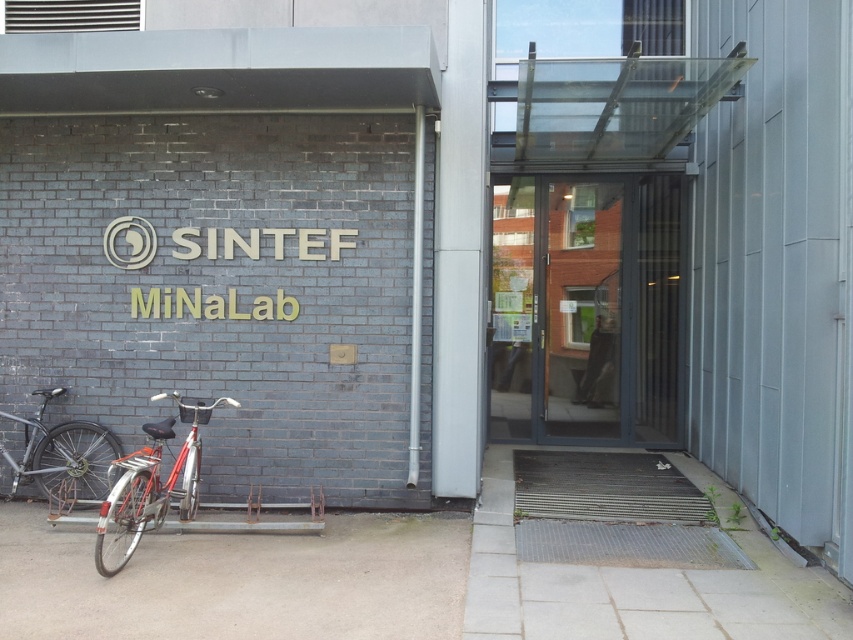
Who is positioned more to the right, transparent glass door at center or shiny red bicycle at lower left?

From the viewer's perspective, transparent glass door at center appears more on the right side.

Can you confirm if transparent glass door at center is wider than shiny red bicycle at lower left?

Indeed, transparent glass door at center has a greater width compared to shiny red bicycle at lower left.

From the picture: Who is more forward, [502,381] or [155,490]?

Point [155,490]

Where is `transparent glass door at center`? transparent glass door at center is located at coordinates (585, 308).

Which of these two, shiny red bicycle at lower left or silver metallic bicycle at lower left, stands taller?

Standing taller between the two is shiny red bicycle at lower left.

Does shiny red bicycle at lower left appear under silver metallic bicycle at lower left?

Yes.

What do you see at coordinates (149, 486) in the screenshot? The width and height of the screenshot is (853, 640). I see `shiny red bicycle at lower left` at bounding box center [149, 486].

The image size is (853, 640). What are the coordinates of `shiny red bicycle at lower left` in the screenshot? It's located at (149, 486).

Is transparent glass door at center below silver metallic bicycle at lower left?

No, transparent glass door at center is not below silver metallic bicycle at lower left.

Who is higher up, transparent glass door at center or silver metallic bicycle at lower left?

Positioned higher is transparent glass door at center.

This screenshot has width=853, height=640. What do you see at coordinates (585, 308) in the screenshot?
I see `transparent glass door at center` at bounding box center [585, 308].

You are a GUI agent. You are given a task and a screenshot of the screen. Output one action in this format:
    pyautogui.click(x=<x>, y=<y>)
    Task: Click on the transparent glass door at center
    
    Given the screenshot: What is the action you would take?
    pyautogui.click(x=585, y=308)